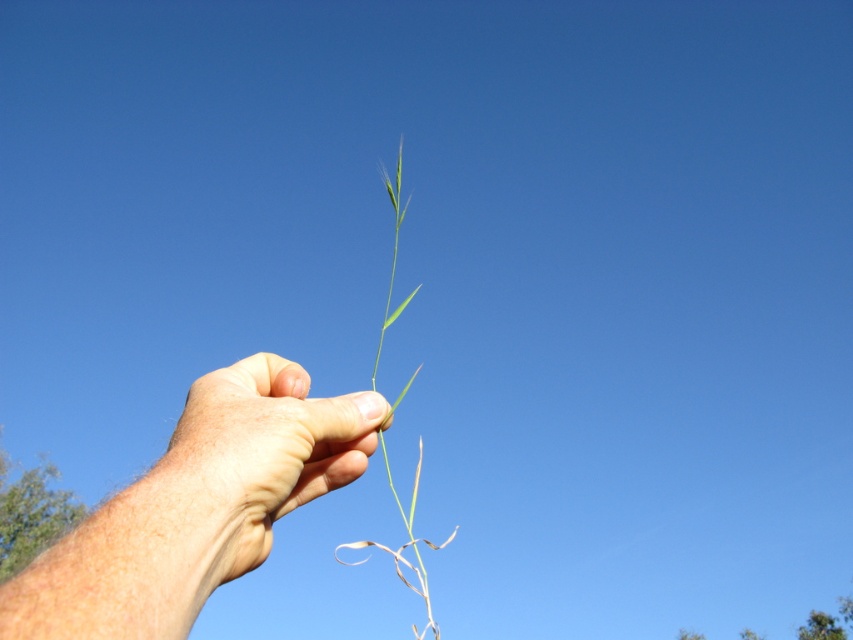
Between point (212, 497) and point (421, 465), which one is positioned in front?

Positioned in front is point (212, 497).

Does skinny green stem at center appear under green matte grass at center?

No, skinny green stem at center is not below green matte grass at center.

Does point (265, 372) come closer to viewer compared to point (396, 548)?

No, it is behind (396, 548).

The height and width of the screenshot is (640, 853). Identify the location of skinny green stem at center. (196, 506).

Which of these two, skinny green leaf at center or green matte grass at center, stands taller?

With more height is green matte grass at center.

Can you confirm if skinny green leaf at center is smaller than green matte grass at center?

Yes.

Does point (210, 406) come in front of point (426, 584)?

No.

At what (x,y) coordinates should I click in order to perform the action: click on skinny green leaf at center. Please return your answer as a coordinate pair (x, y). This screenshot has height=640, width=853. Looking at the image, I should click on (248, 467).

Is skinny green stem at center wider than skinny green leaf at center?

Yes, skinny green stem at center is wider than skinny green leaf at center.

Can you confirm if skinny green stem at center is positioned above skinny green leaf at center?

Incorrect, skinny green stem at center is not positioned above skinny green leaf at center.

Between point (148, 563) and point (199, 394), which one is positioned in front?

Point (148, 563)

What are the coordinates of `skinny green stem at center` in the screenshot? It's located at (196, 506).